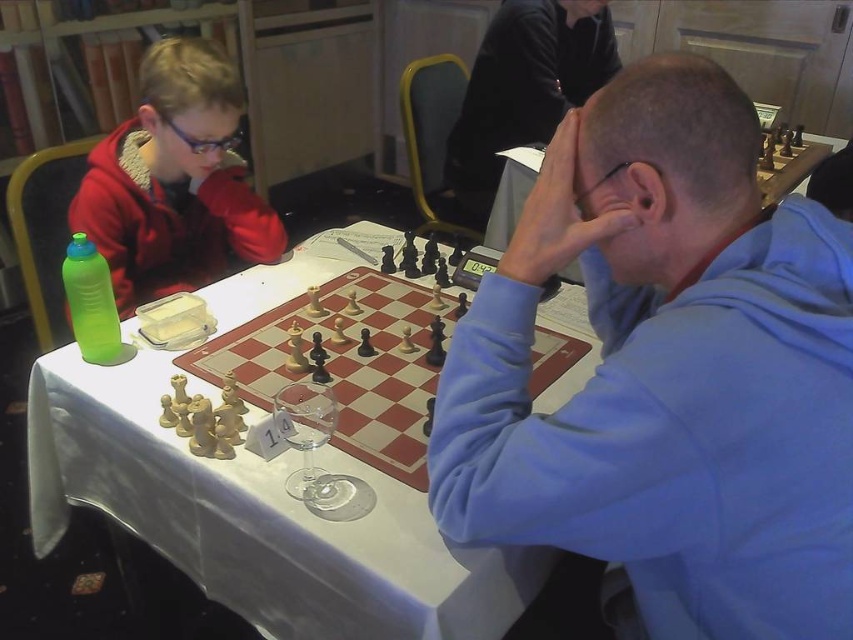
Who is more forward, (103,179) or (451,168)?

Positioned in front is point (103,179).

Does matte red jacket at upper left have a lesser width compared to smooth black jacket at upper center?

Yes, matte red jacket at upper left is thinner than smooth black jacket at upper center.

At what (x,y) coordinates should I click in order to perform the action: click on matte red jacket at upper left. Please return your answer as a coordinate pair (x, y). Looking at the image, I should click on (x=173, y=180).

Does wooden chess set at center appear over wooden chessboard at center?

Actually, wooden chess set at center is below wooden chessboard at center.

Between wooden chess set at center and wooden chessboard at center, which one has more height?

With more height is wooden chess set at center.

Is point (412, 365) positioned behind point (804, 168)?

No, (412, 365) is closer to viewer.

The height and width of the screenshot is (640, 853). Find the location of `wooden chess set at center`. wooden chess set at center is located at coordinates (x=343, y=368).

Does white cloth table at center have a smaller size compared to matte red jacket at upper left?

No.

Who is more forward, (242, 451) or (177, 80)?

Point (242, 451) is more forward.

Locate an element on the screen. This screenshot has height=640, width=853. white cloth table at center is located at coordinates (256, 518).